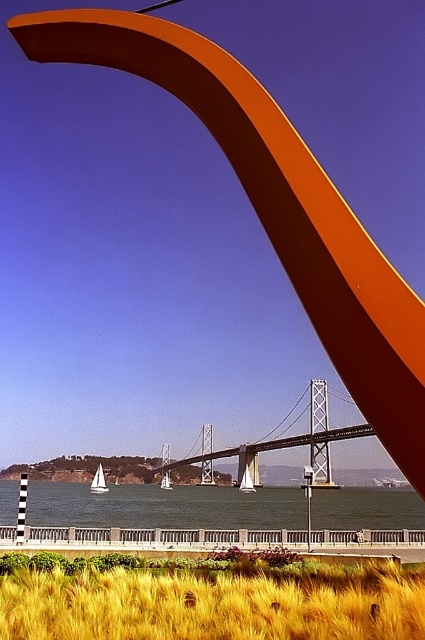
You are standing on the shore and want to take a photo of the blue water at center and the metallic gray bridge at center. Which one should you zoom in on to capture more details?

The blue water at center is larger in size than the metallic gray bridge at center, so you should zoom in on the metallic gray bridge at center to capture more details since it is smaller and requires closer focus.

You are a delivery drone with a wingspan of 1.5 meters. You need to fly from the metallic gray bridge at center to the blue water at center. Is there enough space between them for you to pass through?

The blue water at center and metallic gray bridge at center are 8.14 meters apart from each other, so yes, the drone can pass through the space between them since 8.14 meters is more than sufficient for a 1.5 meter wingspan.